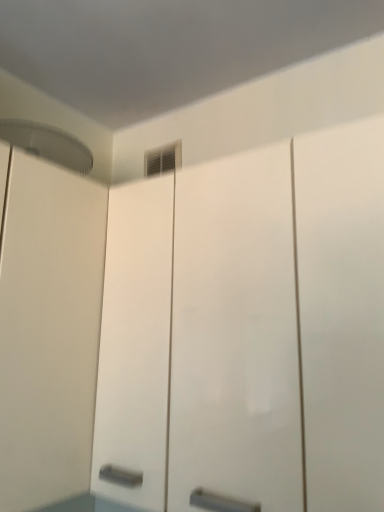
In order to face white glossy cupboard at center, should I rotate leftwards or rightwards?

To face it directly, rotate right by 0.522 degrees.

What do you see at coordinates (248, 330) in the screenshot? I see `white glossy cupboard at center` at bounding box center [248, 330].

Where is `white glossy cupboard at center`? Image resolution: width=384 pixels, height=512 pixels. white glossy cupboard at center is located at coordinates (248, 330).

At what (x,y) coordinates should I click in order to perform the action: click on white glossy cupboard at center. Please return your answer as a coordinate pair (x, y). This screenshot has height=512, width=384. Looking at the image, I should click on (248, 330).